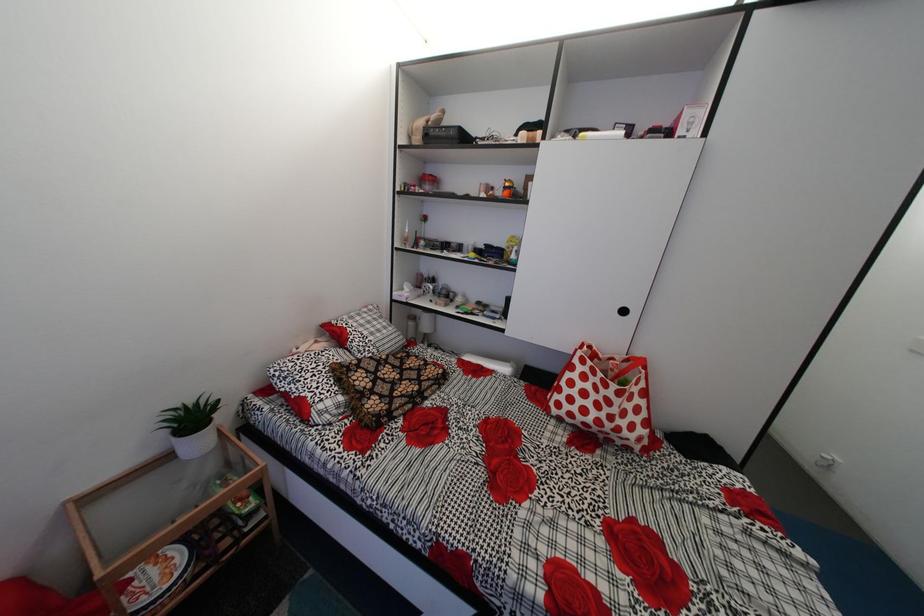
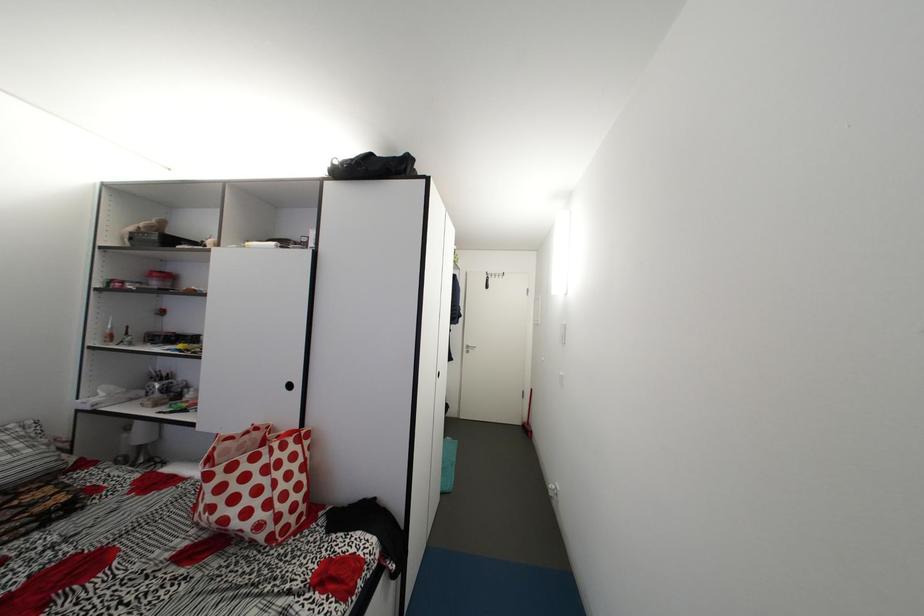
Question: In a continuous first-person perspective shot, in which direction is the camera moving?

Choices:
 (A) Left
 (B) Right
 (C) Forward
 (D) Backward

Answer: (B)